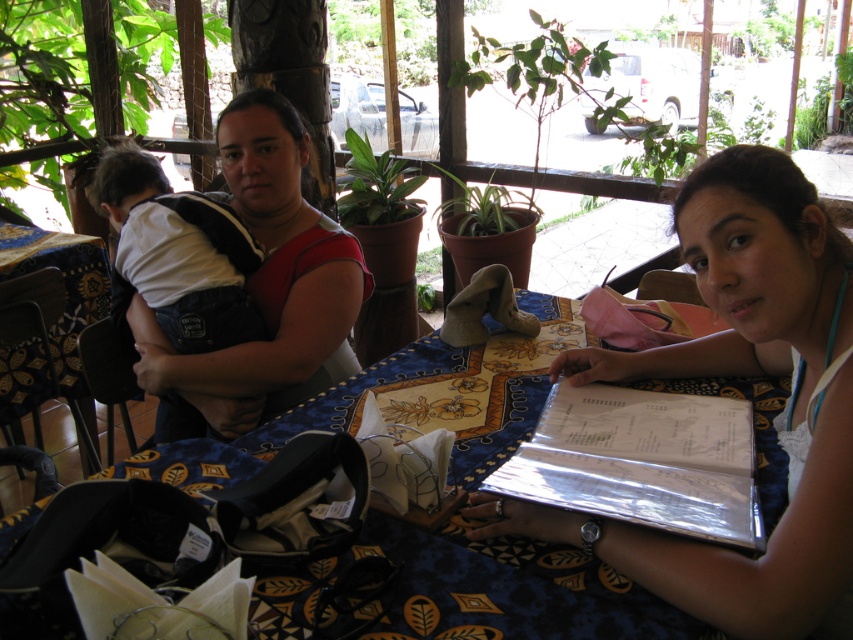
Question: Does matte red dress at upper left have a larger size compared to metallic silver menu at lower right?

Choices:
 (A) yes
 (B) no

Answer: (A)

Question: Is white plastic menu at center bigger than denim overalls at left?

Choices:
 (A) no
 (B) yes

Answer: (A)

Question: Which object is positioned closest to the matte red dress at upper left?

Choices:
 (A) metallic silver menu at lower right
 (B) white plastic menu at center

Answer: (A)

Question: Which of the following is the closest to the observer?

Choices:
 (A) (201, 308)
 (B) (699, 180)
 (C) (236, 209)
 (D) (679, 396)

Answer: (B)

Question: Which is farther from the metallic silver menu at lower right?

Choices:
 (A) white plastic menu at center
 (B) denim overalls at left
 (C) matte red dress at upper left

Answer: (B)

Question: Does matte red dress at upper left appear under denim overalls at left?

Choices:
 (A) no
 (B) yes

Answer: (B)